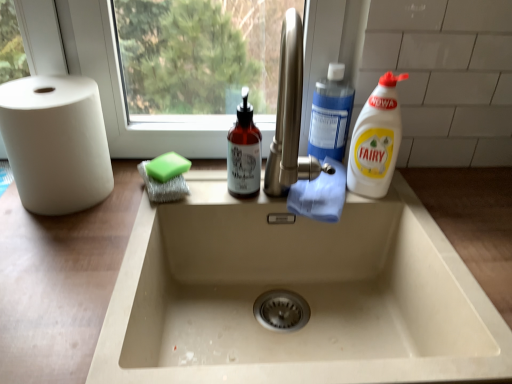
Locate an element on the screen. Image resolution: width=512 pixels, height=384 pixels. free space that is to the left of green sponge at upper left is located at coordinates (97, 198).